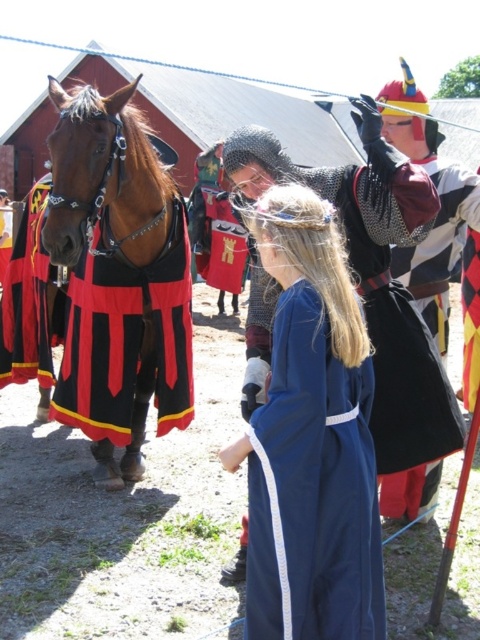
You are an archer positioned at the origin point of the scene. You need to shoot an arrow to hit the blue satin dress at center. What are the coordinates you should aim for?

The coordinates you should aim for are 0.686 on the x axis and 0.648 on the y axis, as the blue satin dress at center is located at point (x=311, y=438).

You are a guest at the medieval event and want to approach the chainmail armor at center. However, there is a shiny brown horse at left blocking your path. Can you walk around the horse to reach the armor?

The shiny brown horse at left is to the left of chainmail armor at center, so you can walk around the horse on the right side to reach the armor.